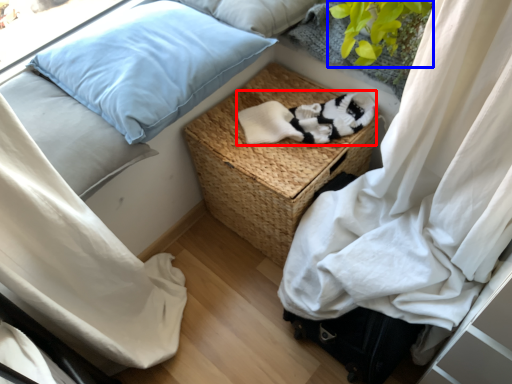
Question: Which object appears farthest to the camera in this image, clothing (highlighted by a red box) or plant (highlighted by a blue box)?

Choices:
 (A) clothing
 (B) plant

Answer: (A)